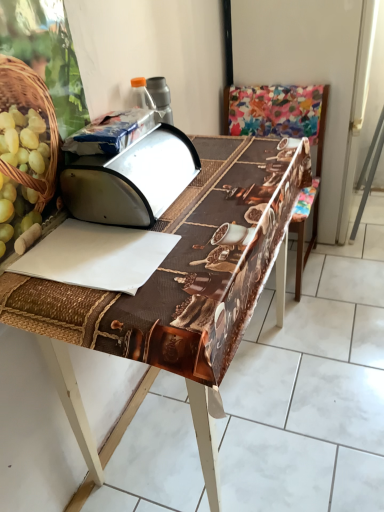
Locate an element on the screen. The height and width of the screenshot is (512, 384). vacant region to the right of multicolored fabric chair at center is located at coordinates (350, 266).